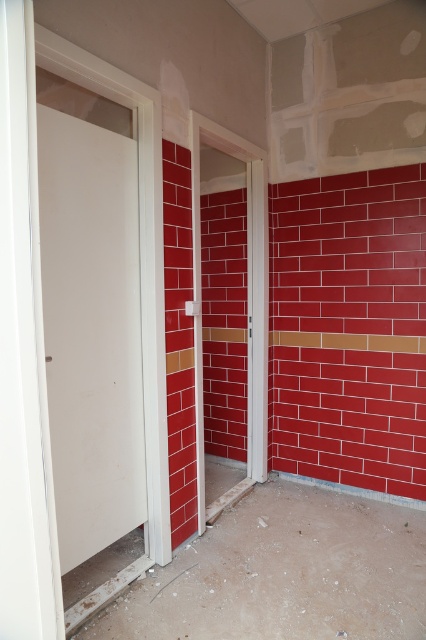
Who is lower down, white matte door at left or white glossy door at center?

white matte door at left is lower down.

Is white matte door at left to the right of white glossy door at center from the viewer's perspective?

In fact, white matte door at left is to the left of white glossy door at center.

You are a GUI agent. You are given a task and a screenshot of the screen. Output one action in this format:
    pyautogui.click(x=<x>, y=<y>)
    Task: Click on the white matte door at left
    The width and height of the screenshot is (426, 640).
    Given the screenshot: What is the action you would take?
    click(92, 332)